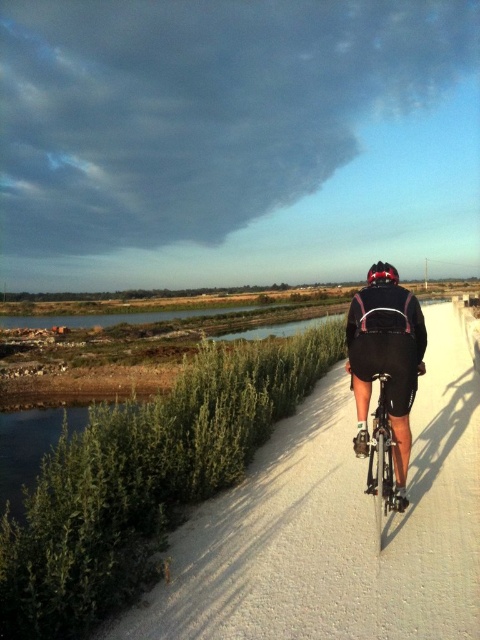
What do you see at coordinates (336, 525) in the screenshot? The width and height of the screenshot is (480, 640). I see `white textured path at center` at bounding box center [336, 525].

Identify the location of white textured path at center. (336, 525).

Which is behind, point (331, 372) or point (379, 550)?

The point (331, 372) is more distant.

Identify the location of white textured path at center. (336, 525).

Can you confirm if shiny metallic bicycle at center is positioned to the right of matte black helmet at center?

In fact, shiny metallic bicycle at center is to the left of matte black helmet at center.

Which is more to the right, shiny metallic bicycle at center or matte black helmet at center?

matte black helmet at center is more to the right.

What do you see at coordinates (381, 460) in the screenshot? I see `shiny metallic bicycle at center` at bounding box center [381, 460].

Locate an element on the screen. This screenshot has height=640, width=480. shiny metallic bicycle at center is located at coordinates (381, 460).

Can you confirm if white textured path at center is taller than matte black helmet at center?

No.

Identify the location of white textured path at center. (336, 525).

Is point (140, 620) more distant than point (382, 273)?

No, (140, 620) is in front of (382, 273).

You are a GUI agent. You are given a task and a screenshot of the screen. Output one action in this format:
    pyautogui.click(x=<x>, y=<y>)
    Task: Click on the white textured path at center
    
    Given the screenshot: What is the action you would take?
    pyautogui.click(x=336, y=525)